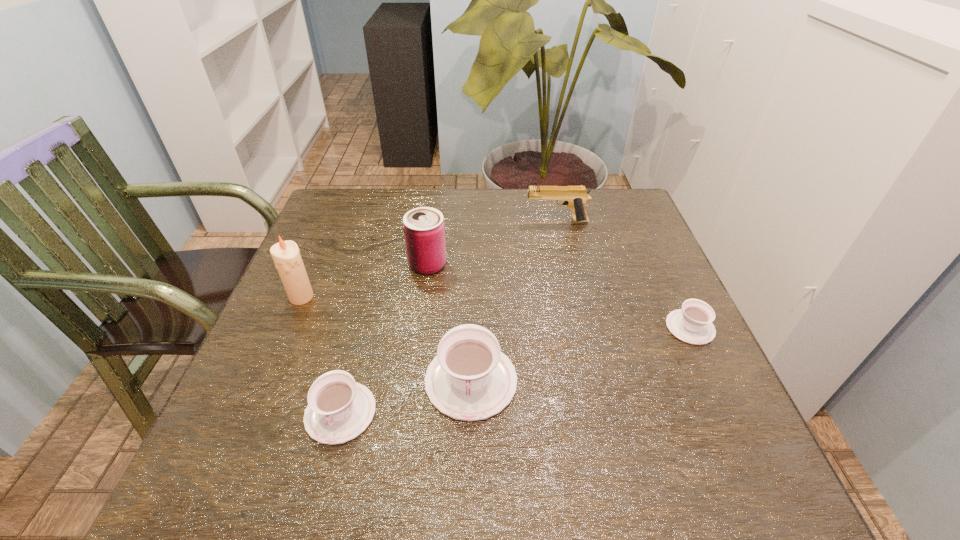
You are a GUI agent. You are given a task and a screenshot of the screen. Output one action in this format:
    pyautogui.click(x=<x>, y=<y>)
    Task: Click on the spot to insert another teacup for uniform distribution
    The image size is (960, 540).
    Given the screenshot: What is the action you would take?
    pyautogui.click(x=587, y=353)